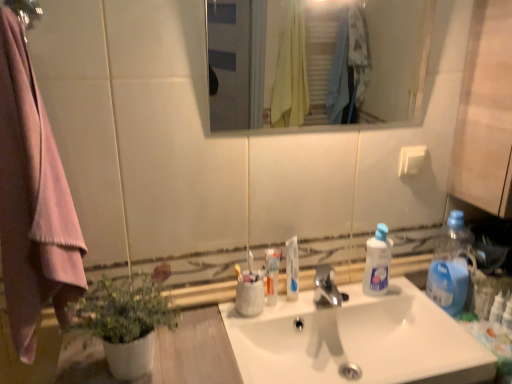
Find the location of a particular element. This screenshot has height=384, width=512. free point in front of white glossy toothpaste at center, the 1th toothpaste from the left is located at coordinates (248, 329).